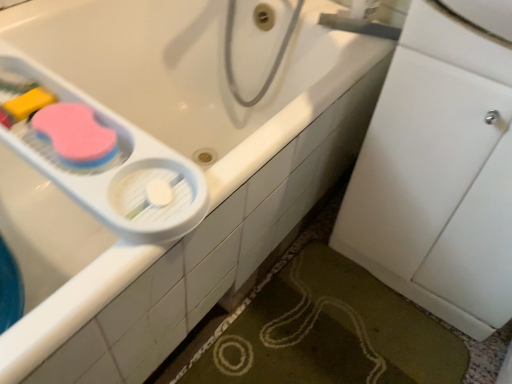
Identify the location of free space below green textured bath mat at lower right (from a real-world perspective). (330, 337).